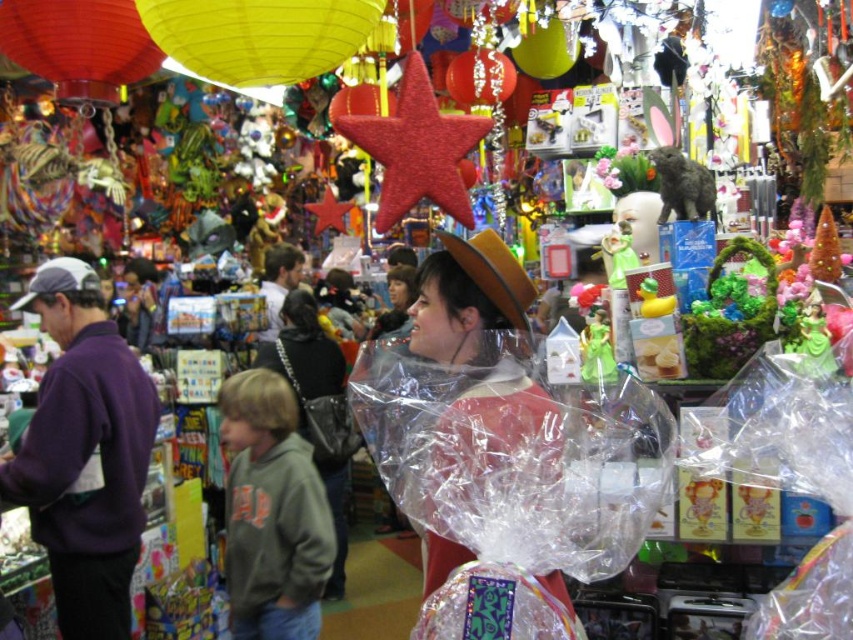
You are a shop assistant trying to arrange items on a shelf. The shelf has a width of 15 cm. You have the matte brown hat at center and the matte black purse at center. Which item can fit on the shelf if you can only place one item at a time?

The matte brown hat at center has a smaller width than the matte black purse at center, so the matte brown hat at center can fit on the 15 cm wide shelf.

You are standing in a toy shop and want to reach a red star decoration located at point (x=138, y=460). If your arm can extend 2 meters, can you reach it?

The distance between you and the red star decoration at point (x=138, y=460) is 2.94 meters. Since your arm can only extend 2 meters, you cannot reach it.

You are a customer in the market and want to pick up the purple fleece sweatshirt at left and the matte brown hat at center. Which item is closer to you?

The purple fleece sweatshirt at left is closer to you because the matte brown hat at center is behind it.